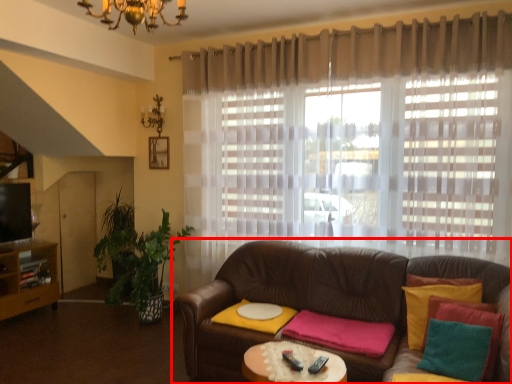
Question: Considering the relative positions of studio couch (annotated by the red box) and curtain in the image provided, where is studio couch (annotated by the red box) located with respect to the staircase?

Choices:
 (A) left
 (B) right

Answer: (A)